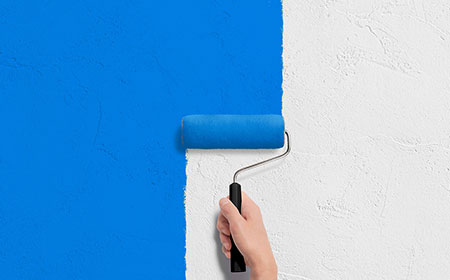
I want to click on wall, so click(334, 116).